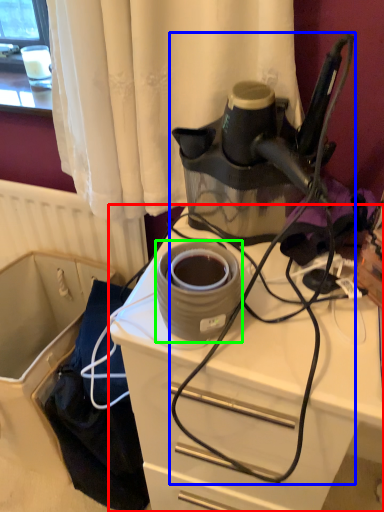
Question: Which object is the closest to the desk (highlighted by a red box)? Choose among these: wire (highlighted by a blue box) or appliance (highlighted by a green box).

Choices:
 (A) wire
 (B) appliance

Answer: (A)